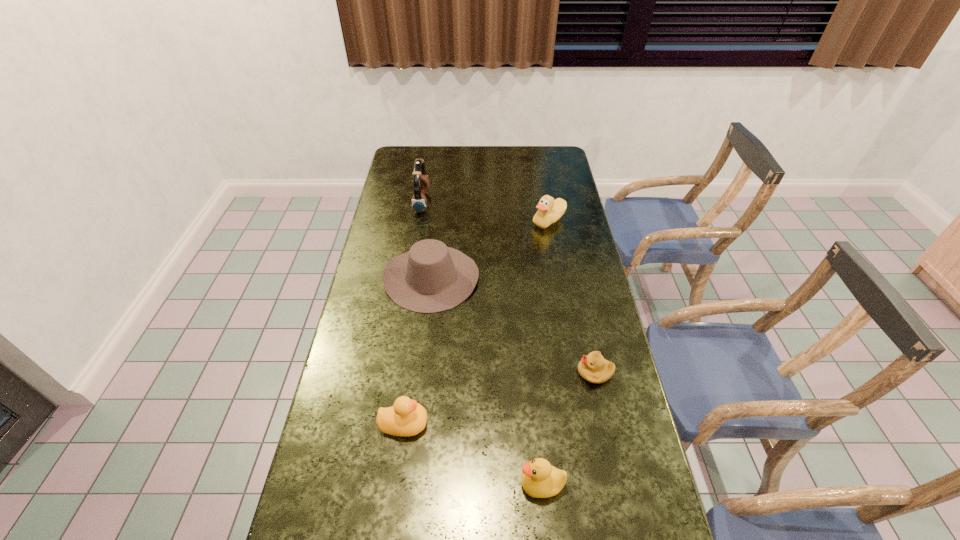
Where is `the tallest object`? The image size is (960, 540). the tallest object is located at coordinates (421, 184).

Find the location of a particular element. the rightmost duck is located at coordinates (549, 211).

This screenshot has width=960, height=540. What are the coordinates of `cowboy hat` in the screenshot? It's located at (431, 277).

Locate an element on the screen. the fifth farthest object is located at coordinates (406, 417).

The height and width of the screenshot is (540, 960). In order to click on the second farthest duck in this screenshot , I will do `click(406, 417)`.

Where is `the second duck from right to left`? the second duck from right to left is located at coordinates (539, 479).

The image size is (960, 540). What are the coordinates of `the nearest duck` in the screenshot? It's located at (539, 479).

Find the location of `the fourth farthest object`. the fourth farthest object is located at coordinates (593, 368).

What are the coordinates of `the shortest object` in the screenshot? It's located at (593, 368).

Image resolution: width=960 pixels, height=540 pixels. What are the coordinates of `free spot located on the ear cup of the tallest object` in the screenshot? It's located at (x=504, y=202).